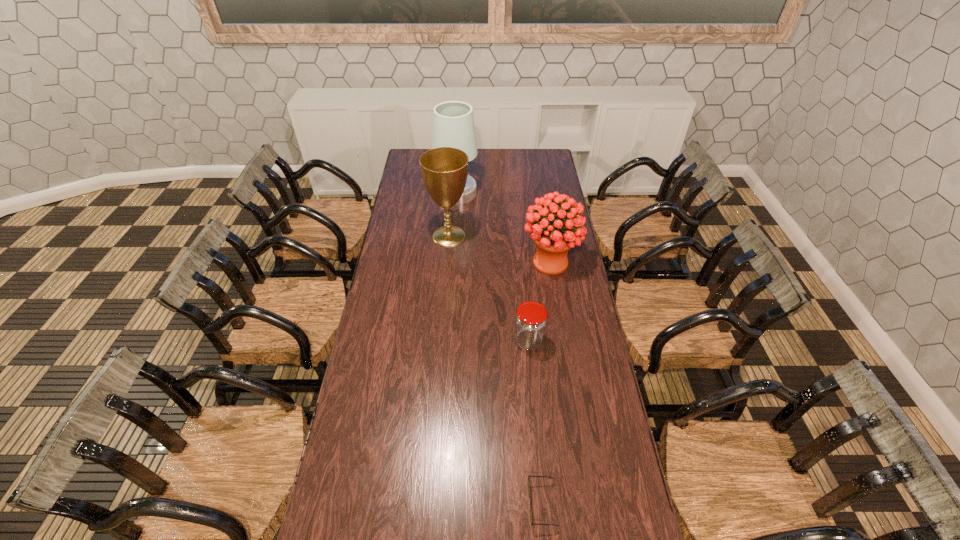
Where is `vacant area located 0.240m on the back of the jar`? This screenshot has height=540, width=960. vacant area located 0.240m on the back of the jar is located at coordinates (523, 285).

At what (x,y) coordinates should I click in order to perform the action: click on vacant area situated on the front-facing side of the shortest object. Please return your answer as a coordinate pair (x, y). Looking at the image, I should click on (396, 504).

Where is `vacant space located 0.250m on the front-facing side of the shortest object`? This screenshot has width=960, height=540. vacant space located 0.250m on the front-facing side of the shortest object is located at coordinates 444,504.

Identify the location of free space located 0.050m on the front-facing side of the shortest object. (512, 504).

This screenshot has height=540, width=960. In order to click on object that is positioned at the right edge in this screenshot , I will do `click(553, 235)`.

Find the location of a particular element. The height and width of the screenshot is (540, 960). free space at the left edge of the desktop is located at coordinates (370, 399).

This screenshot has width=960, height=540. I want to click on vacant space at the right edge, so click(618, 461).

Identify the location of vacant region at the far left corner. This screenshot has height=540, width=960. (410, 160).

Image resolution: width=960 pixels, height=540 pixels. In the image, there is a desktop. Find the location of `vacant space at the far right corner`. vacant space at the far right corner is located at coordinates (532, 155).

Identify the location of free point between the bouquet and the fourth tallest object. The width and height of the screenshot is (960, 540). (540, 301).